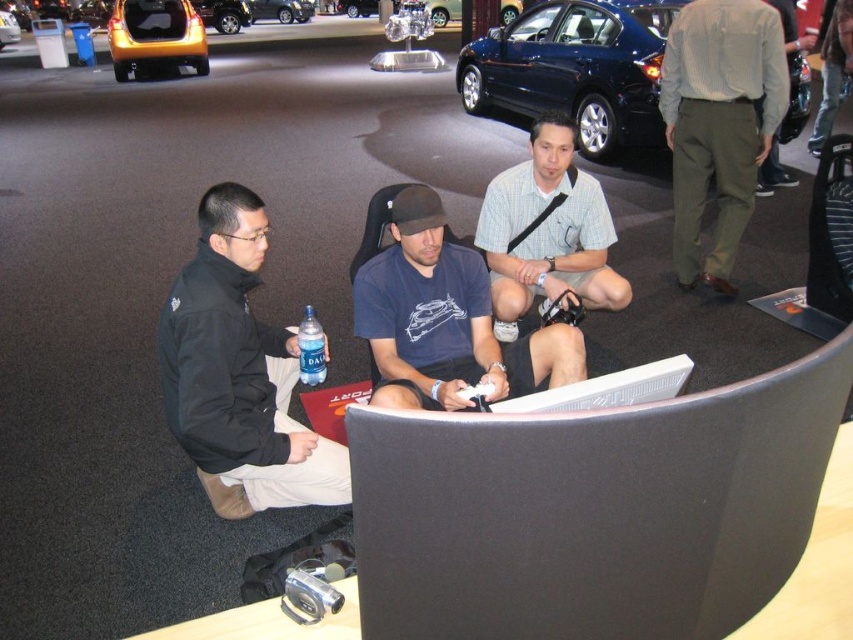
You are standing in the exhibition hall and see the black fabric jacket at left and the gold metallic hatchback at center. Which object is closer to you?

The black fabric jacket at left is closer to you because it is in front of the gold metallic hatchback at center.